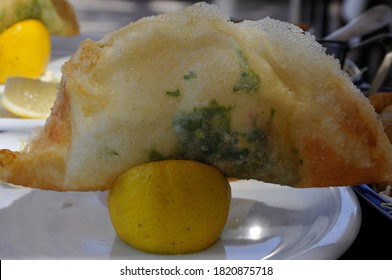
Image resolution: width=392 pixels, height=280 pixels. In order to click on table in this screenshot , I will do `click(368, 231)`.